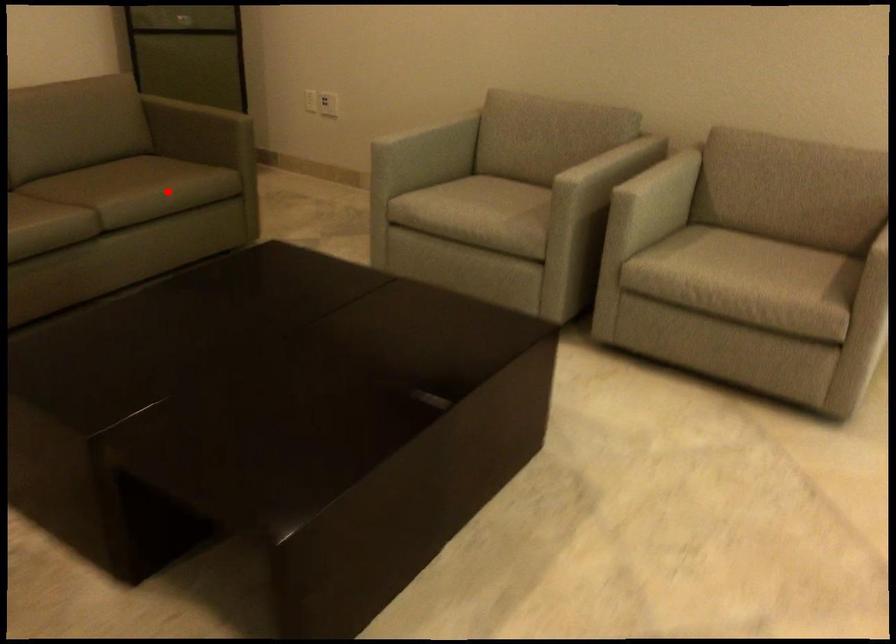
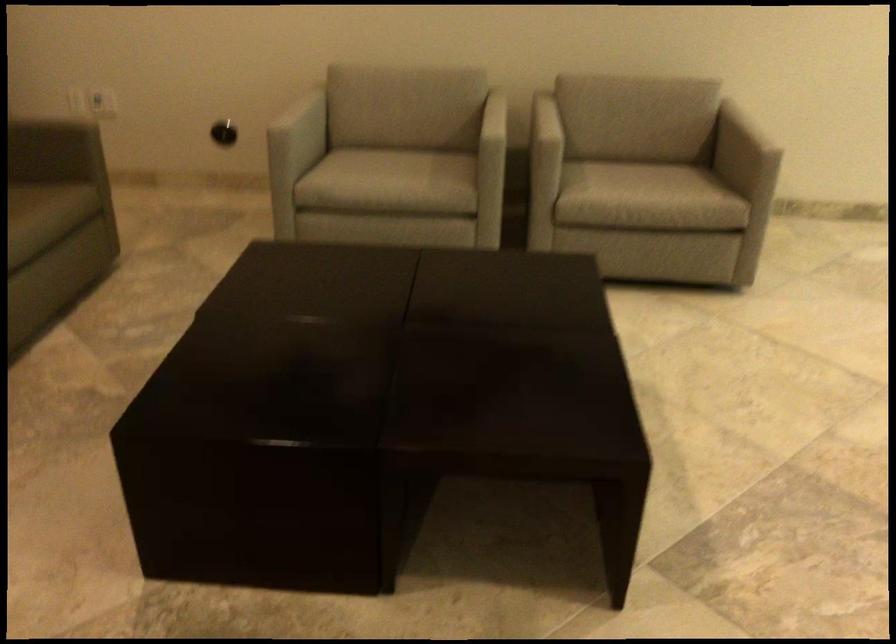
Question: I am providing you with two images of the same scene from different viewpoints. Image1 has a red point marked. In image2, the corresponding 3D location appears at what relative position? Reply with the corresponding letter.

Choices:
 (A) Closer
 (B) Farther

Answer: (A)